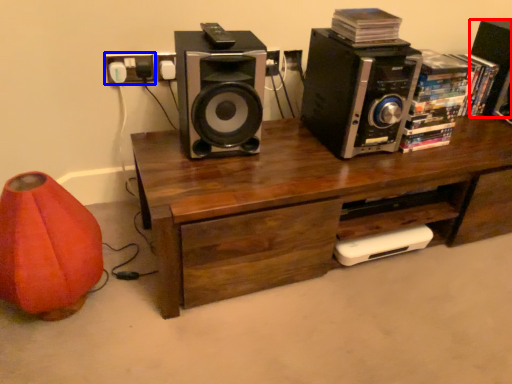
Question: Which of the following is the farthest to the observer, speaker (highlighted by a red box) or electric outlet (highlighted by a blue box)?

Choices:
 (A) speaker
 (B) electric outlet

Answer: (A)